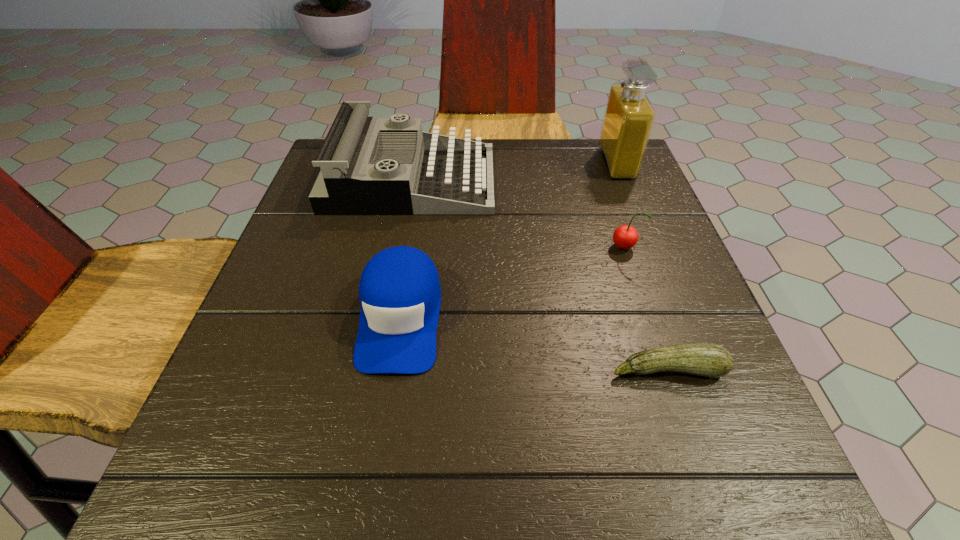
Where is `empty space between the third nearest object and the baseball cap`? The width and height of the screenshot is (960, 540). empty space between the third nearest object and the baseball cap is located at coordinates (512, 282).

The image size is (960, 540). In order to click on empty space between the zucchini and the typewriter in this screenshot , I will do `click(540, 274)`.

Find the location of a particular element. free space between the typewriter and the third farthest object is located at coordinates (517, 214).

I want to click on free space that is in between the cherry and the zucchini, so click(x=645, y=308).

Locate an element on the screen. The height and width of the screenshot is (540, 960). object that ranks as the closest to the typewriter is located at coordinates (399, 291).

Where is `object that ranks as the third closest to the tallest object`? This screenshot has height=540, width=960. object that ranks as the third closest to the tallest object is located at coordinates (399, 291).

Locate an element on the screen. The height and width of the screenshot is (540, 960). free location that satisfies the following two spatial constraints: 1. on the typing side of the typewriter; 2. on the back side of the third nearest object is located at coordinates (397, 248).

The image size is (960, 540). In order to click on vacant space that satisfies the following two spatial constraints: 1. on the typing side of the fourth shortest object; 2. on the back side of the third farthest object in this screenshot , I will do `click(397, 248)`.

This screenshot has width=960, height=540. What are the coordinates of `free space that satisfies the following two spatial constraints: 1. on the typing side of the second tallest object; 2. on the left side of the cherry` in the screenshot? It's located at (397, 248).